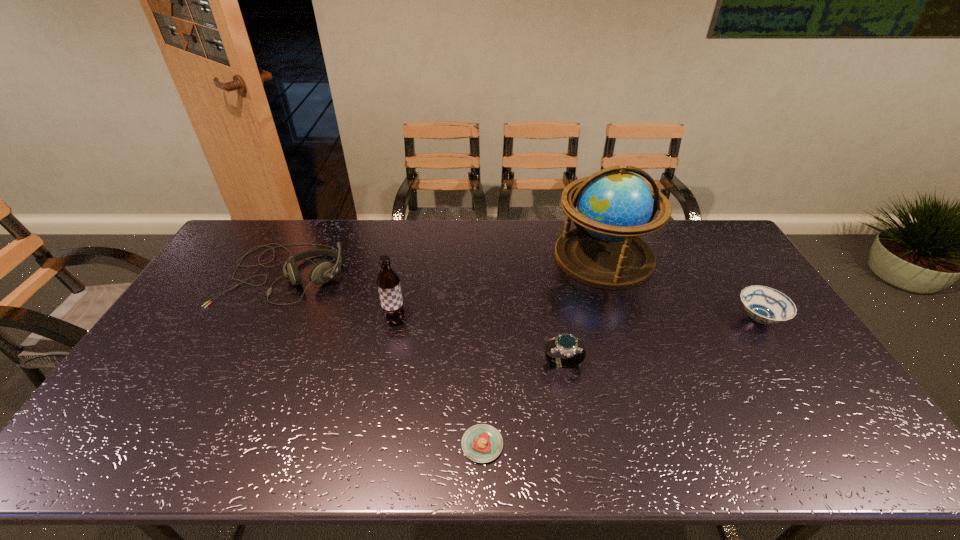
In order to click on the tallest object in this screenshot , I will do `click(615, 206)`.

The width and height of the screenshot is (960, 540). I want to click on the fifth object from right to left, so click(x=388, y=282).

Locate an element on the screen. root beer is located at coordinates (388, 282).

Locate an element on the screen. The width and height of the screenshot is (960, 540). headset is located at coordinates (322, 272).

Locate an element on the screen. The width and height of the screenshot is (960, 540). watch is located at coordinates (566, 344).

The width and height of the screenshot is (960, 540). I want to click on the second shortest object, so click(x=765, y=305).

Locate an element on the screen. soup bowl is located at coordinates (765, 305).

This screenshot has width=960, height=540. Identify the location of the third object from left to right. (482, 443).

The image size is (960, 540). I want to click on the nearest object, so click(x=482, y=443).

You are a GUI agent. You are given a task and a screenshot of the screen. Output one action in this format:
    pyautogui.click(x=<x>, y=<y>)
    Task: Click on the vacant space positioned on the front of the tallest object
    Image resolution: width=960 pixels, height=540 pixels.
    Given the screenshot: What is the action you would take?
    pyautogui.click(x=641, y=370)